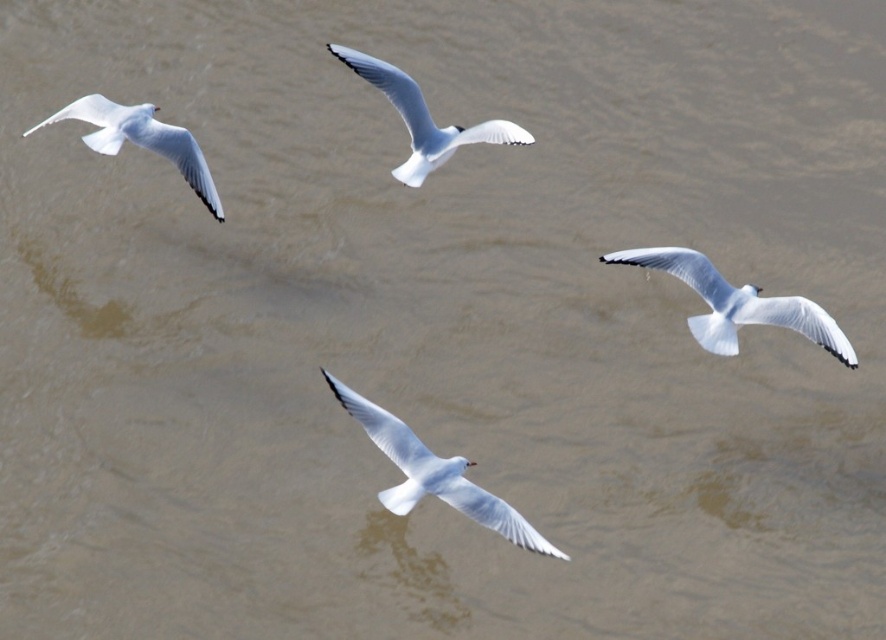
You are a birdwatcher observing the scene. You notice two birds in the sky. The white matte seagull at lower right and the white matte bird at center. Which one appears closer to you based on their positions?

The white matte seagull at lower right appears closer because the white matte bird at center is positioned behind it.

You are standing on a boat deck and see the white matte seagull at lower right. If the boat has a 20 feet safety zone around it, is the seagull within the safety zone?

The white matte seagull at lower right is 18.65 feet away from camera, which is within the 20 feet safety zone.